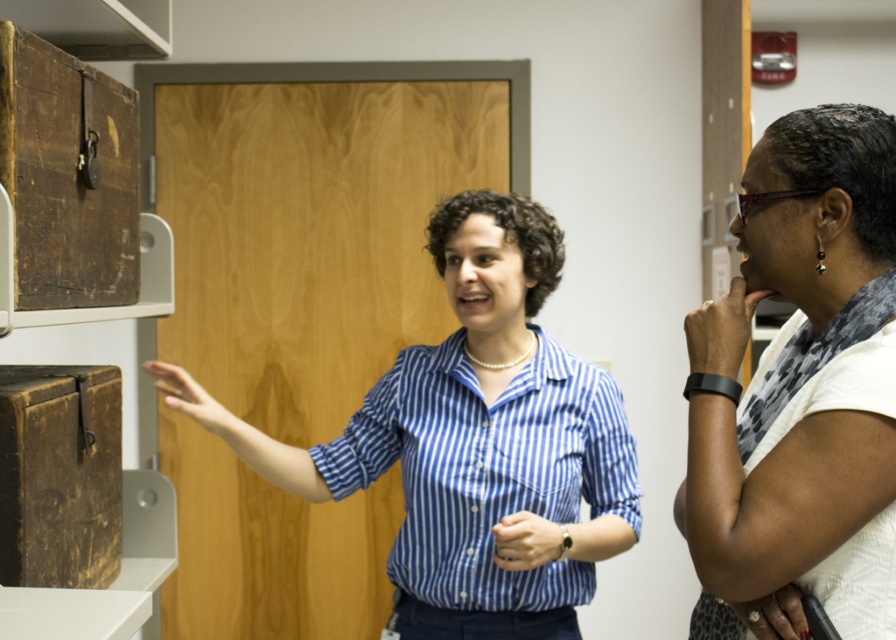
Question: Can you confirm if blue striped shirt at center is smaller than rustic wood drawer at upper left?

Choices:
 (A) yes
 (B) no

Answer: (B)

Question: Which point is farther to the camera?

Choices:
 (A) rustic wood drawer at upper left
 (B) blue striped shirt at center
 (C) white textured shirt at right

Answer: (B)

Question: Which of the following is the farthest from the observer?

Choices:
 (A) click(847, 481)
 (B) click(470, 557)
 (C) click(128, 243)

Answer: (B)

Question: Observing the image, what is the correct spatial positioning of blue striped shirt at center in reference to white textured shirt at right?

Choices:
 (A) left
 (B) right

Answer: (A)

Question: Among these objects, which one is nearest to the camera?

Choices:
 (A) white textured shirt at right
 (B) rustic wood drawer at upper left
 (C) blue striped shirt at center

Answer: (A)

Question: Does blue striped shirt at center appear on the left side of white textured shirt at right?

Choices:
 (A) yes
 (B) no

Answer: (A)